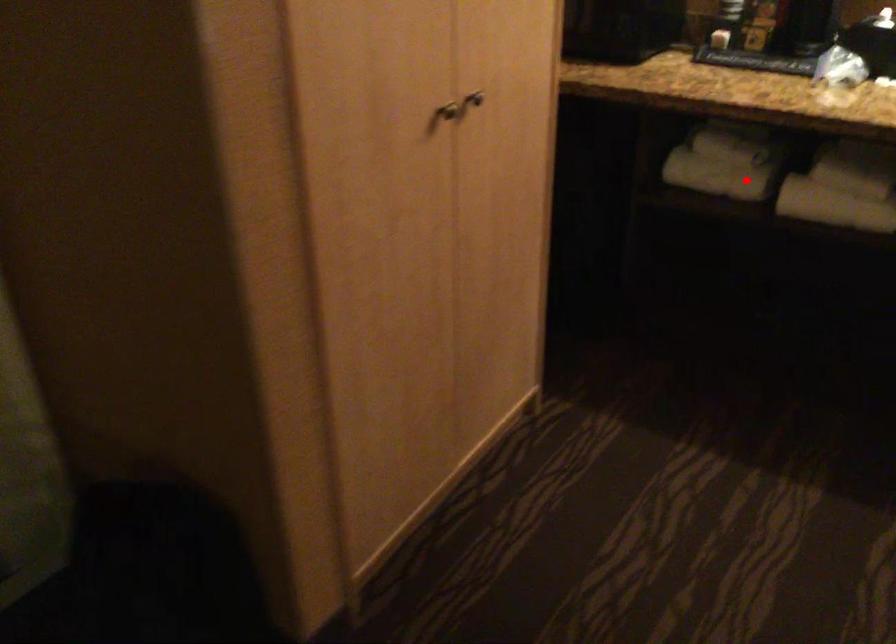
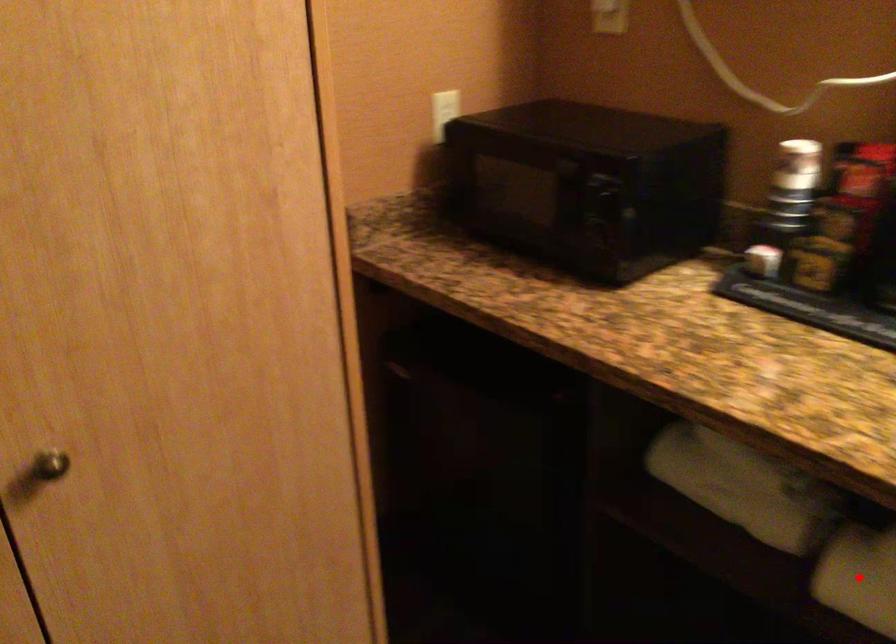
I am providing you with two images of the same scene from different viewpoints. A red point is marked on the first image and another point is marked on the second image. Are the points marked in image1 and image2 representing the same 3D position?

No